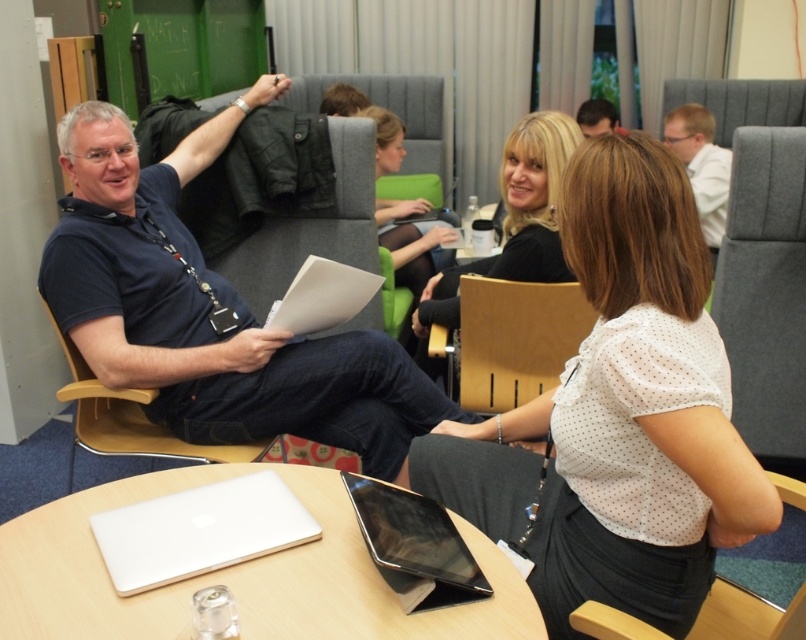
Question: Which point is farther to the camera?

Choices:
 (A) (376, 220)
 (B) (696, 150)
 (C) (489, 272)

Answer: (B)

Question: Does white plastic laptop at center have a lesser width compared to matte black jacket at center?

Choices:
 (A) yes
 (B) no

Answer: (B)

Question: Can you confirm if white plastic laptop at center is thinner than white matte paper at center?

Choices:
 (A) no
 (B) yes

Answer: (A)

Question: Does black fabric chair at center have a larger size compared to dark brown hair at upper center?

Choices:
 (A) yes
 (B) no

Answer: (B)

Question: Which object appears farthest from the camera in this image?

Choices:
 (A) gray fabric chair at right
 (B) dark brown hair at upper center
 (C) white plastic laptop at center

Answer: (B)

Question: Which of the following is the farthest from the observer?

Choices:
 (A) gray fabric chair at right
 (B) matte black jacket at center
 (C) white matte laptop at lower center
 (D) black fabric chair at center

Answer: (B)